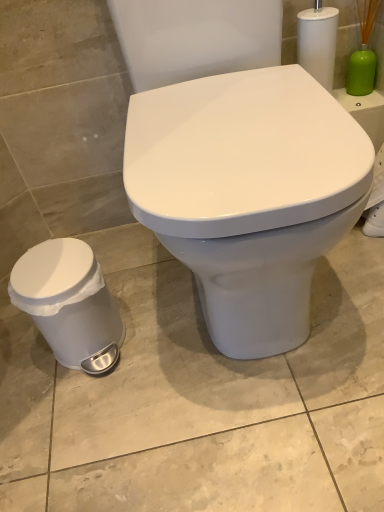
At what (x,y) coordinates should I click in order to perform the action: click on green matte brush at upper right. Please return your answer as a coordinate pair (x, y). The height and width of the screenshot is (512, 384). Looking at the image, I should click on (363, 52).

The image size is (384, 512). I want to click on green matte brush at upper right, so click(363, 52).

In the scene shown: Which object is further away from the camera taking this photo, white plastic trash can at lower left or white glossy toilet at center?

Positioned behind is white plastic trash can at lower left.

Can you confirm if white plastic trash can at lower left is wider than white glossy toilet at center?

In fact, white plastic trash can at lower left might be narrower than white glossy toilet at center.

Considering the points (106, 326) and (177, 130), which point is behind, point (106, 326) or point (177, 130)?

Point (106, 326)

Does green matte brush at upper right have a lesser height compared to white glossy toilet at center?

Correct, green matte brush at upper right is not as tall as white glossy toilet at center.

Is green matte brush at upper right oriented towards white glossy toilet at center?

No, green matte brush at upper right is not turned towards white glossy toilet at center.

Does green matte brush at upper right have a greater width compared to white glossy toilet at center?

No.

From the image's perspective, is green matte brush at upper right located above or below white plastic trash can at lower left?

green matte brush at upper right is above white plastic trash can at lower left.

Between green matte brush at upper right and white plastic trash can at lower left, which one has smaller size?

With smaller size is green matte brush at upper right.

Measure the distance between green matte brush at upper right and white plastic trash can at lower left.

A distance of 33.45 inches exists between green matte brush at upper right and white plastic trash can at lower left.

Where is `porcelain that is in front of the green matte brush at upper right`? porcelain that is in front of the green matte brush at upper right is located at coordinates (67, 300).

Is there a large distance between white glossy toilet at center and green matte brush at upper right?

No, white glossy toilet at center is not far from green matte brush at upper right.

From the image's perspective, would you say white glossy toilet at center is shown under green matte brush at upper right?

Yes.

From a real-world perspective, which object rests below the other?

white glossy toilet at center is physically lower.

Is white glossy toilet at center oriented towards green matte brush at upper right?

No.

Considering the positions of objects white plastic trash can at lower left and green matte brush at upper right in the image provided, who is more to the right, white plastic trash can at lower left or green matte brush at upper right?

green matte brush at upper right.

Who is smaller, white plastic trash can at lower left or green matte brush at upper right?

green matte brush at upper right is smaller.

Is white plastic trash can at lower left placed right next to green matte brush at upper right?

Answer: No.

From the image's perspective, between white plastic trash can at lower left and green matte brush at upper right, who is located below?

white plastic trash can at lower left, from the image's perspective.

Based on the photo, could white plastic trash can at lower left be considered to be inside white glossy toilet at center?

No, white plastic trash can at lower left is located outside of white glossy toilet at center.

Looking at this image, is white glossy toilet at center bigger than white plastic trash can at lower left?

Correct, white glossy toilet at center is larger in size than white plastic trash can at lower left.

Is point (264, 210) farther from camera compared to point (69, 347)?

No, it is in front of (69, 347).

From a real-world perspective, between white glossy toilet at center and white plastic trash can at lower left, who is vertically lower?

In real-world perspective, white plastic trash can at lower left is lower.

Image resolution: width=384 pixels, height=512 pixels. Identify the location of porcelain on the left of white glossy toilet at center. (67, 300).

Where is `toilet in front of the green matte brush at upper right`? toilet in front of the green matte brush at upper right is located at coordinates (248, 194).

Which object lies further to the anchor point white plastic trash can at lower left, white glossy toilet at center or green matte brush at upper right?

The object further to white plastic trash can at lower left is green matte brush at upper right.

Estimate the real-world distances between objects in this image. Which object is closer to green matte brush at upper right, white plastic trash can at lower left or white glossy toilet at center?

white glossy toilet at center is closer to green matte brush at upper right.

When comparing their distances from white glossy toilet at center, does white plastic trash can at lower left or green matte brush at upper right seem further?

green matte brush at upper right lies further to white glossy toilet at center than the other object.

Estimate the real-world distances between objects in this image. Which object is further from white glossy toilet at center, green matte brush at upper right or white plastic trash can at lower left?

green matte brush at upper right is further to white glossy toilet at center.

Looking at the image, which one is located closer to green matte brush at upper right, white glossy toilet at center or white plastic trash can at lower left?

Among the two, white glossy toilet at center is located nearer to green matte brush at upper right.

From the image, which object appears to be farther from white plastic trash can at lower left, green matte brush at upper right or white glossy toilet at center?

Based on the image, green matte brush at upper right appears to be further to white plastic trash can at lower left.

Identify the location of toilet located between white plastic trash can at lower left and green matte brush at upper right in the left-right direction. The height and width of the screenshot is (512, 384). (248, 194).